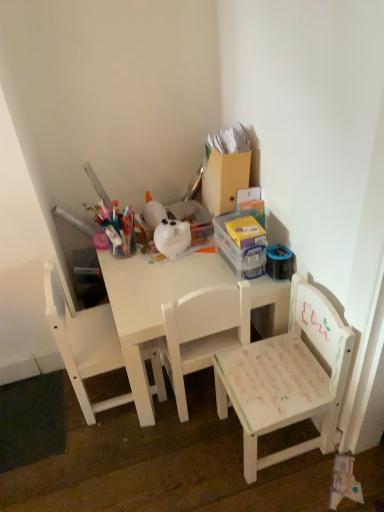
Image resolution: width=384 pixels, height=512 pixels. I want to click on free spot in front of white painted wood chair at lower right, which appears as the 3th chair when viewed from the left, so click(x=286, y=490).